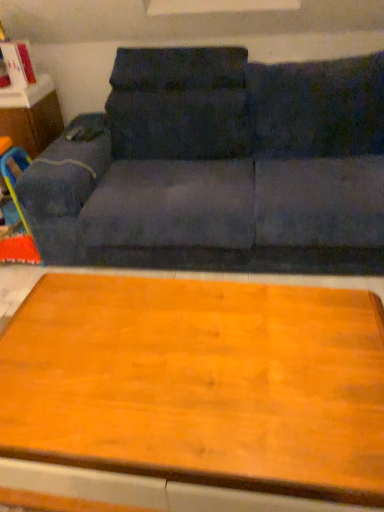
Question: Would you say wooden table at lower center is part of dark blue fabric couch at upper center's contents?

Choices:
 (A) no
 (B) yes

Answer: (A)

Question: Is dark blue fabric couch at upper center bigger than wooden table at lower center?

Choices:
 (A) yes
 (B) no

Answer: (A)

Question: Does dark blue fabric couch at upper center have a greater height compared to wooden table at lower center?

Choices:
 (A) no
 (B) yes

Answer: (B)

Question: Can you confirm if dark blue fabric couch at upper center is shorter than wooden table at lower center?

Choices:
 (A) yes
 (B) no

Answer: (B)

Question: From a real-world perspective, is dark blue fabric couch at upper center positioned over wooden table at lower center based on gravity?

Choices:
 (A) no
 (B) yes

Answer: (B)

Question: Could you tell me if dark blue fabric couch at upper center is facing wooden table at lower center?

Choices:
 (A) yes
 (B) no

Answer: (A)

Question: Is matte wood dresser at left positioned far away from dark blue fabric couch at upper center?

Choices:
 (A) no
 (B) yes

Answer: (A)

Question: Is matte wood dresser at left taller than dark blue fabric couch at upper center?

Choices:
 (A) yes
 (B) no

Answer: (B)

Question: Is matte wood dresser at left outside dark blue fabric couch at upper center?

Choices:
 (A) yes
 (B) no

Answer: (A)

Question: Is matte wood dresser at left positioned in front of dark blue fabric couch at upper center?

Choices:
 (A) no
 (B) yes

Answer: (A)

Question: Can you confirm if matte wood dresser at left is bigger than dark blue fabric couch at upper center?

Choices:
 (A) yes
 (B) no

Answer: (B)

Question: Is the surface of matte wood dresser at left in direct contact with dark blue fabric couch at upper center?

Choices:
 (A) no
 (B) yes

Answer: (A)

Question: Is wooden table at lower center in front of matte wood dresser at left?

Choices:
 (A) yes
 (B) no

Answer: (A)